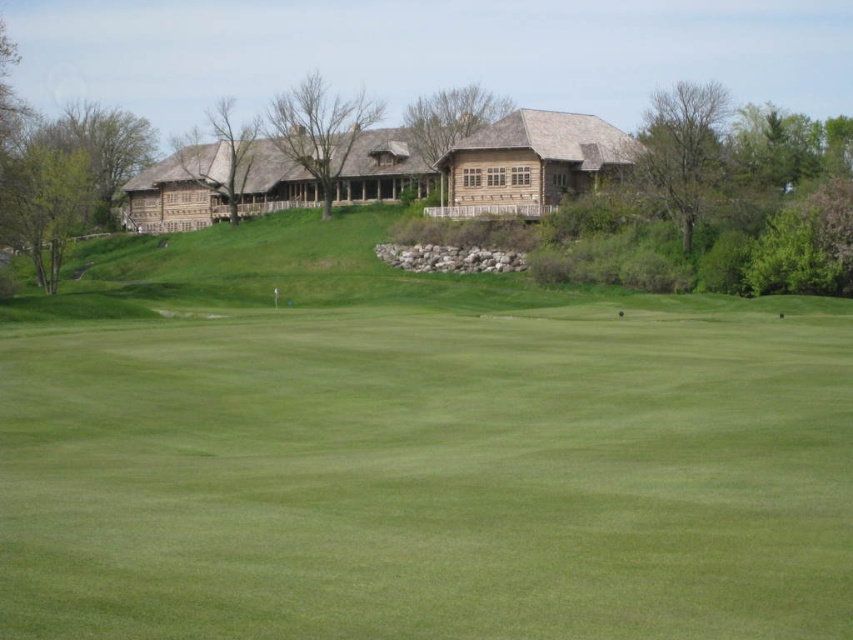
Question: Among these objects, which one is nearest to the camera?

Choices:
 (A) green grass at upper center
 (B) wooden cabin at center

Answer: (A)

Question: Which point is closer to the camera?

Choices:
 (A) wooden cabin at center
 (B) green grass at upper center

Answer: (B)

Question: From the image, what is the correct spatial relationship of green grass at upper center in relation to wooden cabin at center?

Choices:
 (A) left
 (B) right

Answer: (A)

Question: Can you confirm if green grass at upper center is wider than wooden cabin at center?

Choices:
 (A) no
 (B) yes

Answer: (B)

Question: In this image, where is green grass at upper center located relative to wooden cabin at center?

Choices:
 (A) left
 (B) right

Answer: (A)

Question: Among these points, which one is nearest to the camera?

Choices:
 (A) (577, 410)
 (B) (541, 195)

Answer: (A)